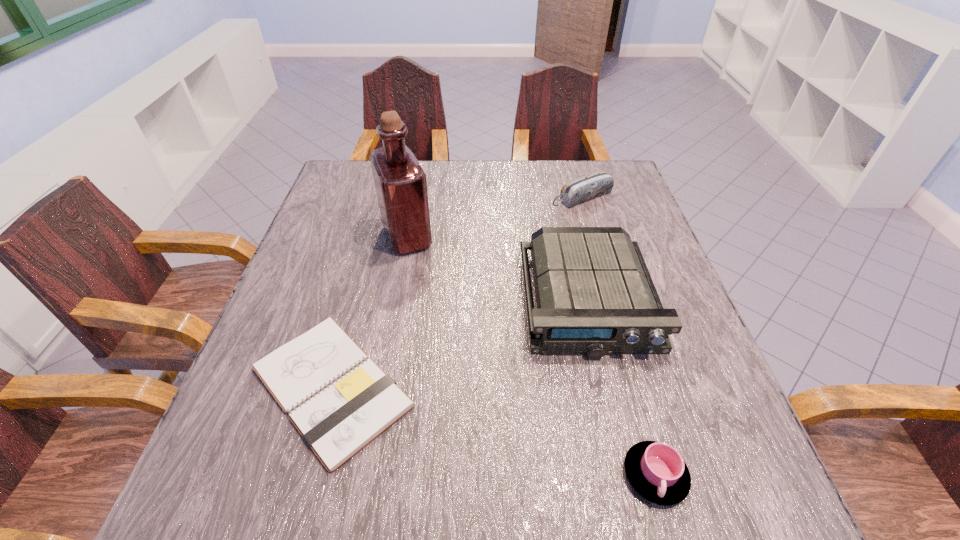
Find the location of a particular element. This screenshot has height=540, width=960. the tallest object is located at coordinates (400, 182).

At what (x,y) coordinates should I click in order to perform the action: click on the fourth shortest object. Please return your answer as a coordinate pair (x, y). Image resolution: width=960 pixels, height=540 pixels. Looking at the image, I should click on (595, 296).

Image resolution: width=960 pixels, height=540 pixels. I want to click on the farthest object, so click(x=591, y=186).

Locate an element on the screen. The image size is (960, 540). pencil box is located at coordinates (591, 186).

This screenshot has width=960, height=540. Identify the location of the fourth tallest object. (656, 470).

What are the coordinates of `notepad` in the screenshot? It's located at (339, 400).

Locate an element on the screen. Image resolution: width=960 pixels, height=540 pixels. free space located 0.320m on the front of the liquor is located at coordinates tap(382, 367).

Find the location of a particular element. This screenshot has width=960, height=540. vacant space located 0.200m on the front panel of the fourth shortest object is located at coordinates (626, 462).

Locate an element on the screen. free space located on the left of the pencil box is located at coordinates (473, 198).

You are a GUI agent. You are given a task and a screenshot of the screen. Output one action in this format:
    pyautogui.click(x=<x>, y=<y>)
    Task: Click on the vacant area situated 0.220m on the back of the notepad
    
    Given the screenshot: What is the action you would take?
    [368, 254]